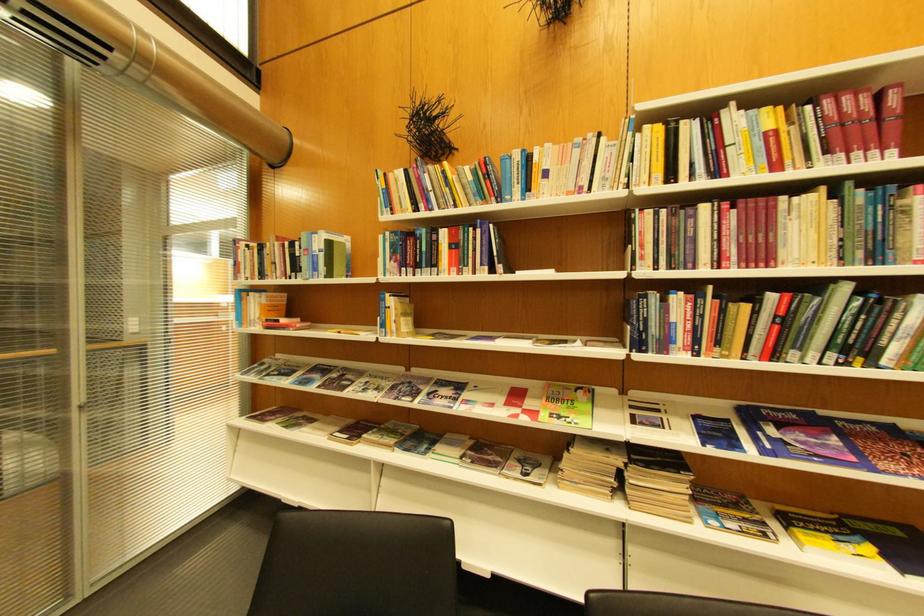
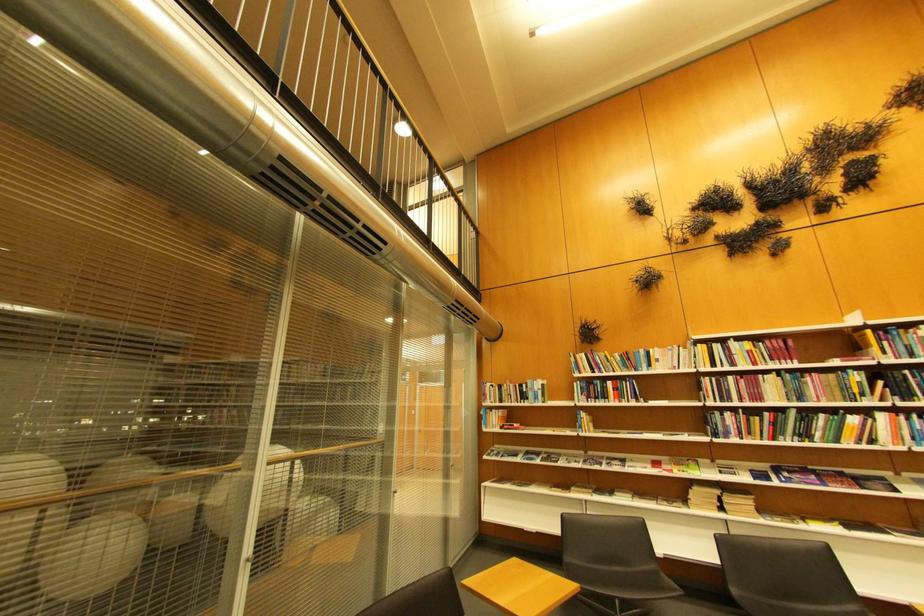
Locate, in the second image, the point that corresponds to the point at 314,237 in the first image.

(540, 383)